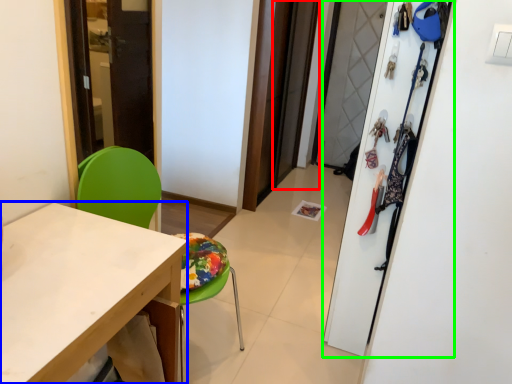
Question: Estimate the real-world distances between objects in this image. Which object is closer to screen door (highlighted by a red box), desk (highlighted by a blue box) or closet (highlighted by a green box)?

Choices:
 (A) desk
 (B) closet

Answer: (B)